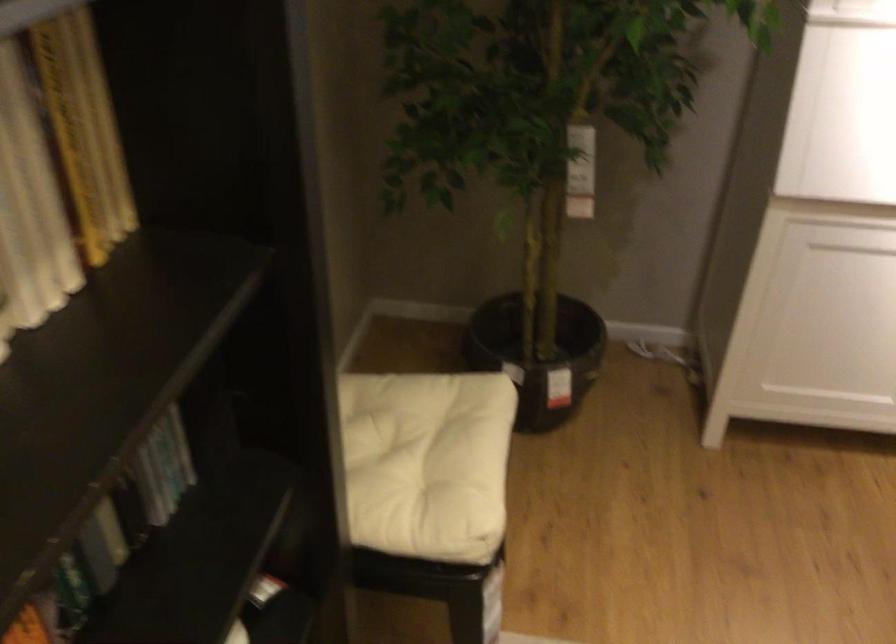
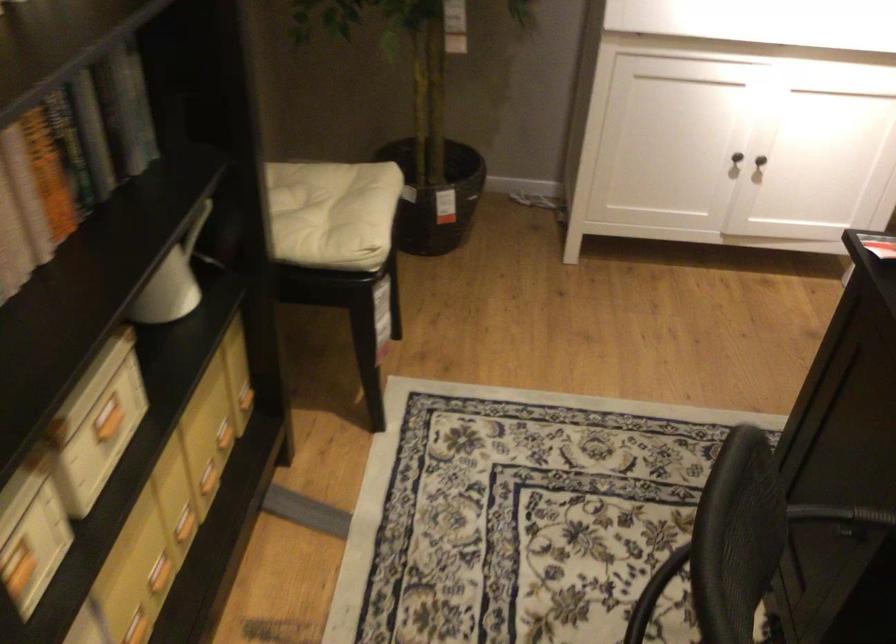
Question: Which direction would the cameraman need to move to produce the second image? Reply with the corresponding letter.

Choices:
 (A) Left
 (B) Right
 (C) Forward
 (D) Backward

Answer: (D)